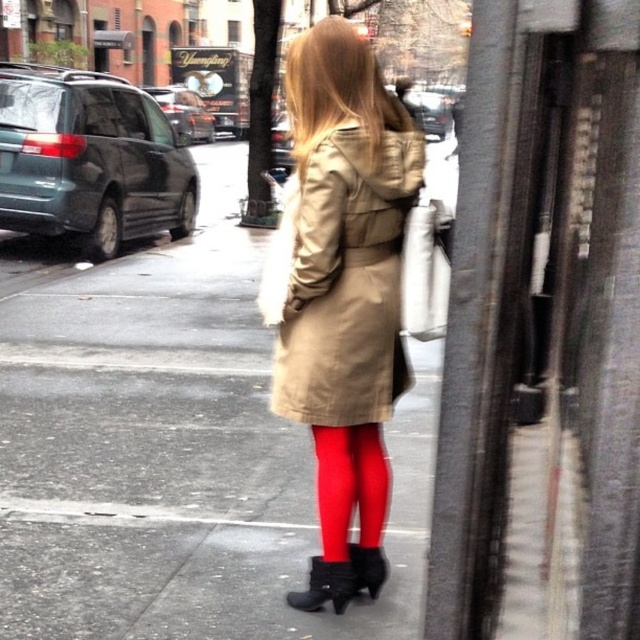
Question: Among these objects, which one is nearest to the camera?

Choices:
 (A) matte beige trench coat at center
 (B) matte black boot at lower center
 (C) shiny black boot at center
 (D) tan fabric coat at center

Answer: (D)

Question: Is tan fabric coat at center positioned before matte black boot at lower center?

Choices:
 (A) no
 (B) yes

Answer: (B)

Question: Which of the following is the closest to the observer?

Choices:
 (A) (336, 609)
 (B) (353, 552)
 (C) (362, 140)
 (D) (115, 326)

Answer: (C)

Question: Is tan fabric coat at center above matte black boot at lower center?

Choices:
 (A) no
 (B) yes

Answer: (B)

Question: Can you confirm if matte beige trench coat at center is positioned above shiny black boot at center?

Choices:
 (A) no
 (B) yes

Answer: (B)

Question: Which of the following is the farthest from the observer?

Choices:
 (A) (317, 166)
 (B) (364, 548)

Answer: (B)